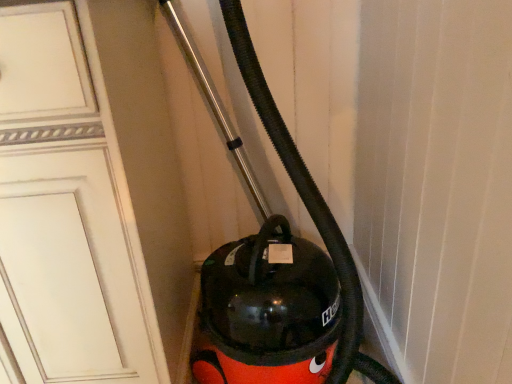
Describe the element at coordinates (85, 174) in the screenshot. This screenshot has width=512, height=384. I see `white glossy door at upper left` at that location.

The width and height of the screenshot is (512, 384). What are the coordinates of `white glossy door at upper left` in the screenshot? It's located at click(x=85, y=174).

The height and width of the screenshot is (384, 512). What are the coordinates of `white glossy door at upper left` in the screenshot? It's located at (85, 174).